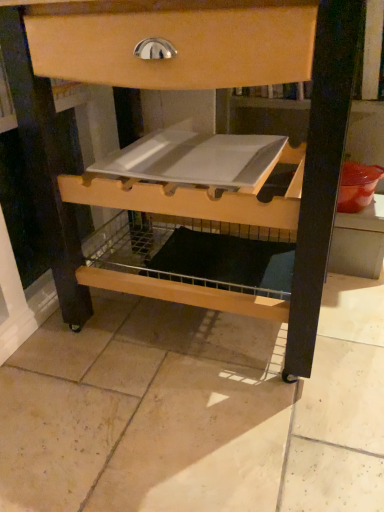
Where is `vacant space in front of matte white tray at center`? Image resolution: width=384 pixels, height=512 pixels. vacant space in front of matte white tray at center is located at coordinates pyautogui.click(x=192, y=431).